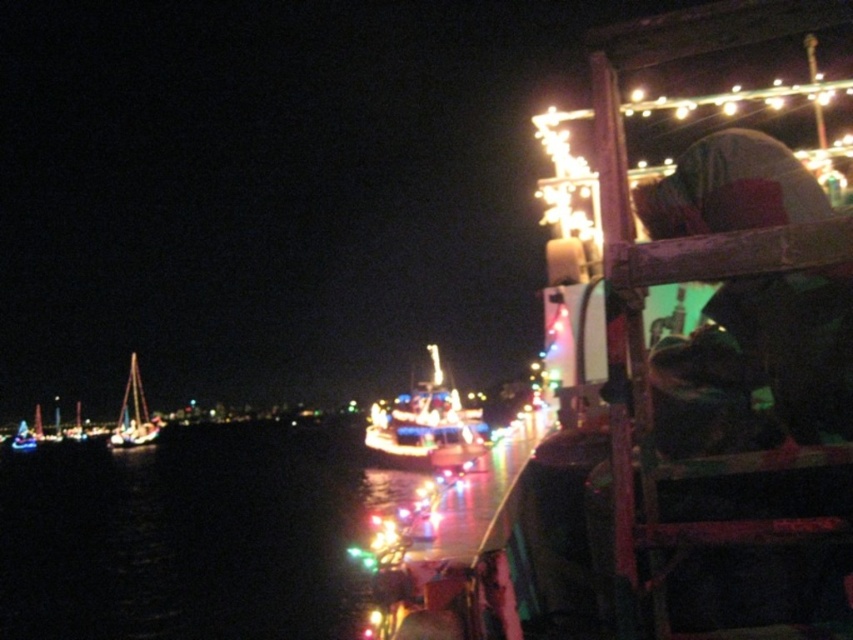
Question: Which object appears closest to the camera in this image?

Choices:
 (A) shiny silver sailboat at left
 (B) shiny blue boat at center

Answer: (B)

Question: Can you confirm if shiny silver sailboat at left is smaller than shiny white sailboat at left?

Choices:
 (A) no
 (B) yes

Answer: (A)

Question: Which object is farther from the camera taking this photo?

Choices:
 (A) shiny silver sailboat at left
 (B) black water at center
 (C) shiny blue boat at center
 (D) shiny white sailboat at left

Answer: (D)

Question: Does shiny silver sailboat at left have a larger size compared to shiny white sailboat at left?

Choices:
 (A) yes
 (B) no

Answer: (A)

Question: Considering the real-world distances, which object is closest to the black water at center?

Choices:
 (A) shiny white sailboat at left
 (B) shiny blue boat at center
 (C) shiny silver sailboat at left

Answer: (B)

Question: Can you confirm if black water at center is smaller than shiny silver sailboat at left?

Choices:
 (A) yes
 (B) no

Answer: (B)